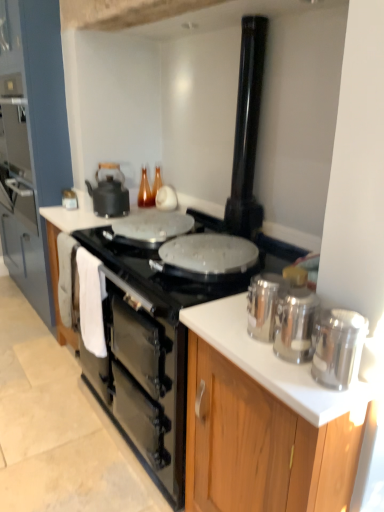
Question: Does black matte oven at center have a lesser width compared to silver metallic canisters at right, the second cabinetry in the left-to-right sequence?

Choices:
 (A) no
 (B) yes

Answer: (A)

Question: Considering the relative sizes of black matte oven at center and silver metallic canisters at right, the second cabinetry in the left-to-right sequence, in the image provided, is black matte oven at center smaller than silver metallic canisters at right, the second cabinetry in the left-to-right sequence,?

Choices:
 (A) no
 (B) yes

Answer: (B)

Question: From a real-world perspective, is black matte oven at center positioned under silver metallic canisters at right, placed as the second cabinetry when sorted from back to front, based on gravity?

Choices:
 (A) no
 (B) yes

Answer: (B)

Question: Can you confirm if black matte oven at center is taller than silver metallic canisters at right, placed as the second cabinetry when sorted from back to front?

Choices:
 (A) yes
 (B) no

Answer: (B)

Question: Can you confirm if black matte oven at center is bigger than silver metallic canisters at right, placed as the second cabinetry when sorted from back to front?

Choices:
 (A) no
 (B) yes

Answer: (A)

Question: From the image's perspective, is polished stainless steel canisters at right, arranged as the second kitchen appliance when ordered from the bottom, positioned above or below white glossy countertop at center?

Choices:
 (A) below
 (B) above

Answer: (B)

Question: Is polished stainless steel canisters at right, the third kitchen appliance in the back-to-front sequence, in front of or behind white glossy countertop at center in the image?

Choices:
 (A) front
 (B) behind

Answer: (A)

Question: Is polished stainless steel canisters at right, positioned as the second kitchen appliance in front-to-back order, wider or thinner than white glossy countertop at center?

Choices:
 (A) thin
 (B) wide

Answer: (A)

Question: Based on their positions, is polished stainless steel canisters at right, positioned as the third kitchen appliance in left-to-right order, located to the left or right of white glossy countertop at center?

Choices:
 (A) right
 (B) left

Answer: (A)

Question: Is black glossy chimney at upper center in front of or behind silver metallic canisters at right, placed as the second cabinetry when sorted from back to front, in the image?

Choices:
 (A) behind
 (B) front

Answer: (A)

Question: Is black glossy chimney at upper center bigger or smaller than silver metallic canisters at right, which appears as the first cabinetry when viewed from the front?

Choices:
 (A) small
 (B) big

Answer: (A)

Question: In terms of height, does black glossy chimney at upper center look taller or shorter compared to silver metallic canisters at right, placed as the second cabinetry when sorted from back to front?

Choices:
 (A) tall
 (B) short

Answer: (B)

Question: Considering the positions of black glossy chimney at upper center and silver metallic canisters at right, placed as the second cabinetry when sorted from back to front, in the image, is black glossy chimney at upper center wider or thinner than silver metallic canisters at right, placed as the second cabinetry when sorted from back to front,?

Choices:
 (A) thin
 (B) wide

Answer: (A)

Question: Looking at their shapes, would you say silver metallic canisters at right, placed as the third kitchen appliance when sorted from front to back, is wider or thinner than white glossy countertop at center?

Choices:
 (A) wide
 (B) thin

Answer: (B)

Question: From a real-world perspective, is silver metallic canisters at right, placed as the third kitchen appliance when sorted from bottom to top, positioned above or below white glossy countertop at center?

Choices:
 (A) above
 (B) below

Answer: (A)